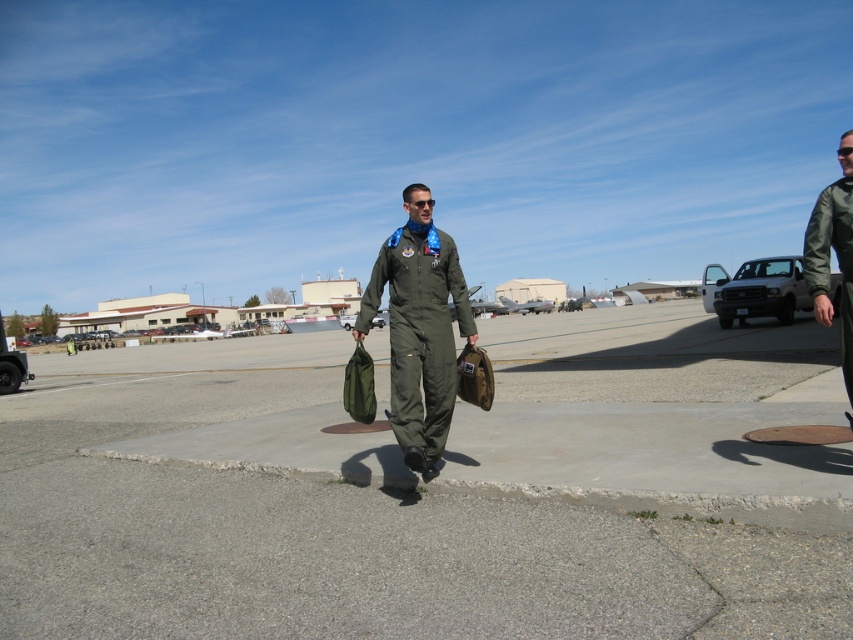
Locate an element on the screen. green fabric bag at center is located at coordinates 341,529.

Does green fabric bag at center have a lesser height compared to green matte jumpsuit at center?

Correct, green fabric bag at center is not as tall as green matte jumpsuit at center.

Is point (35, 476) positioned before point (424, 252)?

No, (35, 476) is behind (424, 252).

Where is `green fabric bag at center`? The width and height of the screenshot is (853, 640). green fabric bag at center is located at coordinates (341, 529).

Is green matte jumpsuit at center behind green matte jacket at right?

Yes, green matte jumpsuit at center is behind green matte jacket at right.

Who is shorter, green matte jumpsuit at center or green matte jacket at right?

green matte jumpsuit at center

You are a GUI agent. You are given a task and a screenshot of the screen. Output one action in this format:
    pyautogui.click(x=<x>, y=<y>)
    Task: Click on the green matte jumpsuit at center
    The image size is (853, 640).
    Given the screenshot: What is the action you would take?
    pyautogui.click(x=419, y=328)

Where is `green matte jumpsuit at center`? The height and width of the screenshot is (640, 853). green matte jumpsuit at center is located at coordinates (419, 328).

Is green fabric bag at center to the right of green matte jacket at right from the viewer's perspective?

No, green fabric bag at center is not to the right of green matte jacket at right.

Which is more to the right, green fabric bag at center or green matte jacket at right?

green matte jacket at right is more to the right.

Which is behind, point (49, 467) or point (838, 179)?

The point (49, 467) is behind.

The image size is (853, 640). In order to click on green fabric bag at center in this screenshot , I will do [341, 529].